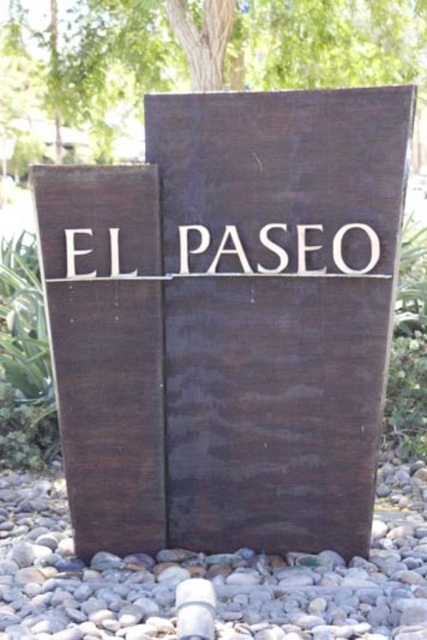
You are standing in front of the sign structure. There is a point at coordinates (x=228, y=321). What object is located at that point?

The point at coordinates (x=228, y=321) corresponds to the dark brown wood sign at center.

You are standing in front of the sign structure. There is a dark brown wood sign at center and gray gravel at lower center. Which object is positioned to the right side?

The dark brown wood sign at center is to the right of gray gravel at lower center.

You are designing a garden layout and need to ensure that the dark brown wood sign at center is visible above the gray gravel at lower center. Based on the image, will the sign be tall enough to remain visible without being obscured by the gravel?

The dark brown wood sign at center has a greater height compared to gray gravel at lower center, so yes, the sign will remain visible above the gravel without being obscured.